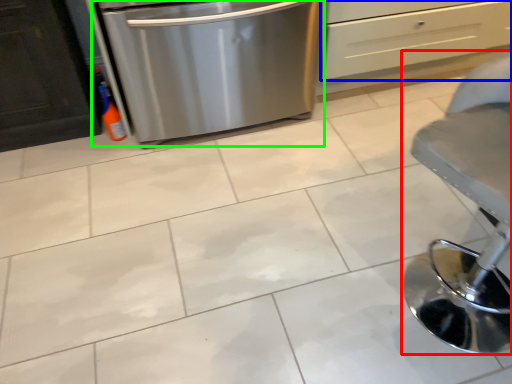
Question: Considering the real-world distances, which object is farthest from furniture (highlighted by a red box)? drawer (highlighted by a blue box) or home appliance (highlighted by a green box)?

Choices:
 (A) drawer
 (B) home appliance

Answer: (A)